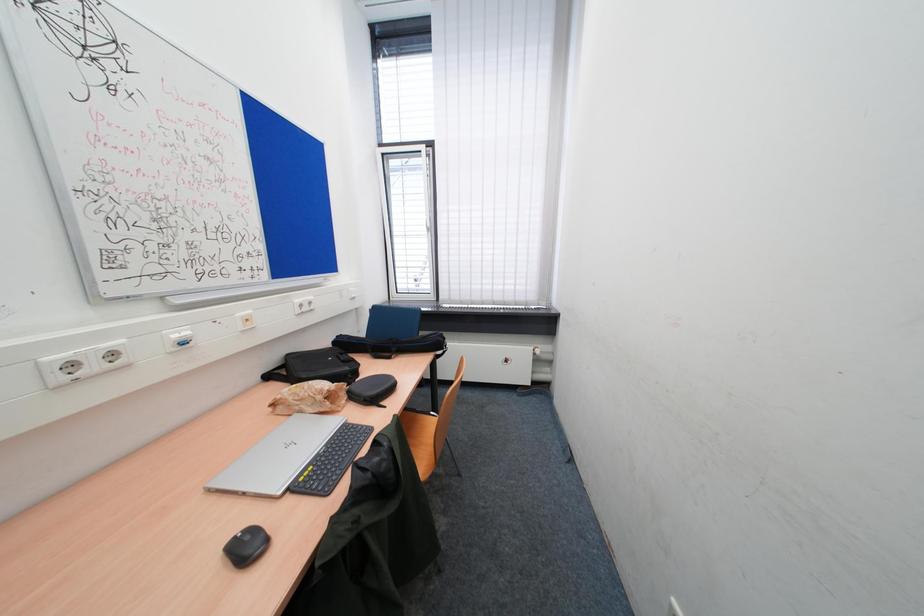
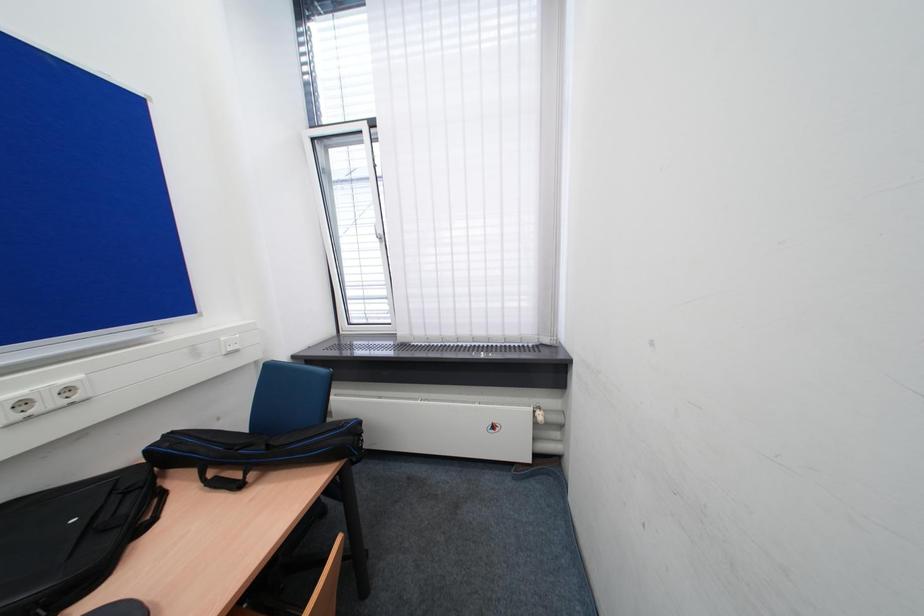
Which direction would the cameraman need to move to produce the second image?

The cameraman moved toward right, forward.